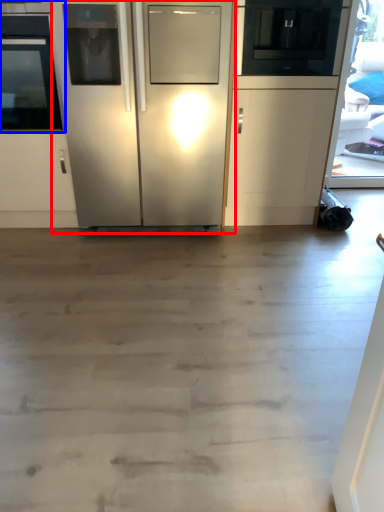
Question: Which point is further to the camera, refrigerator (highlighted by a red box) or oven (highlighted by a blue box)?

Choices:
 (A) refrigerator
 (B) oven

Answer: (B)